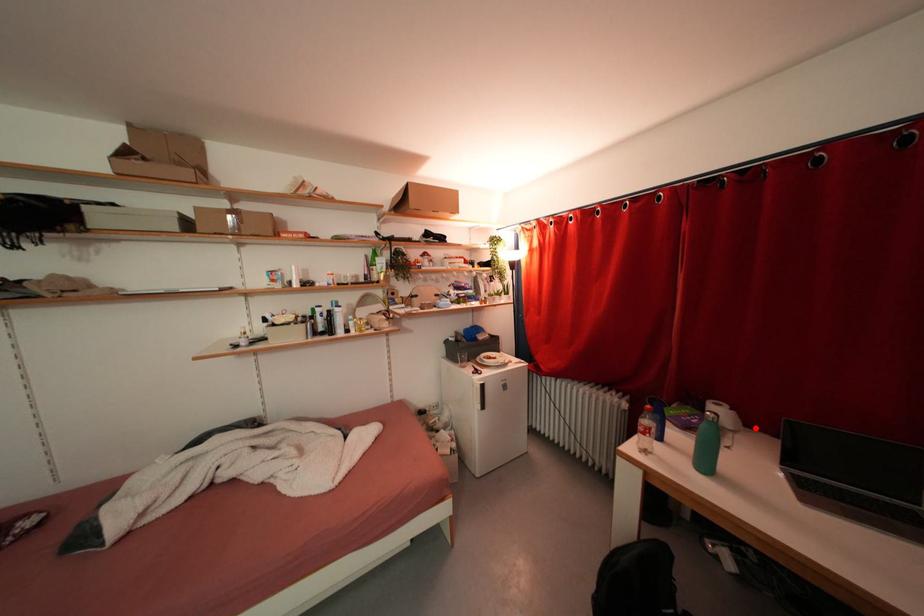
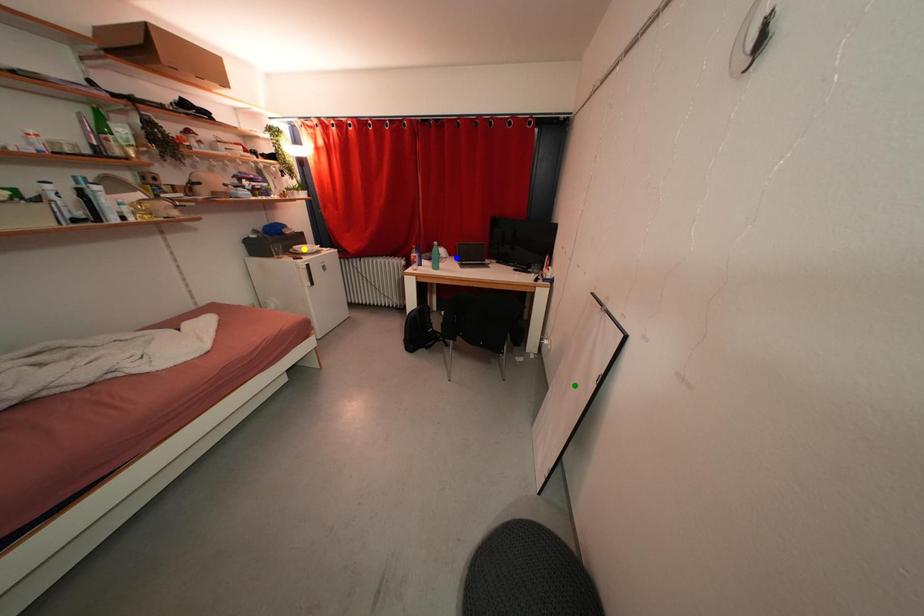
Question: I am providing you with two images of the same scene from different viewpoints. A red point is marked on the first image. You are given multiple points on the second image. Which point in image 2 represents the same 3d spot as the red point in image 1?

Choices:
 (A) yellow point
 (B) blue point
 (C) green point

Answer: (B)